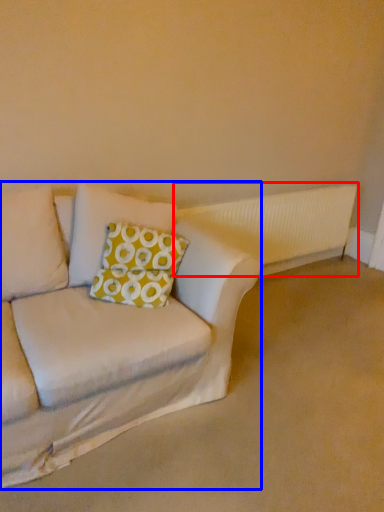
Question: Which object appears closest to the camera in this image, radiator (highlighted by a red box) or studio couch (highlighted by a blue box)?

Choices:
 (A) radiator
 (B) studio couch

Answer: (B)